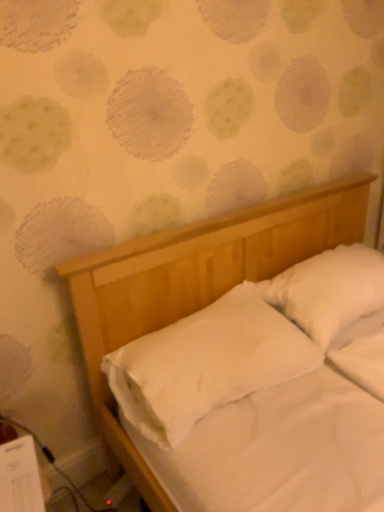
Question: Does white soft pillow at upper right, placed as the 2th pillow when sorted from left to right, turn towards white smooth pillow at center, the first pillow in the left-to-right sequence?

Choices:
 (A) yes
 (B) no

Answer: (B)

Question: Considering the relative sizes of white soft pillow at upper right, placed as the 2th pillow when sorted from left to right, and white smooth pillow at center, the first pillow in the left-to-right sequence, in the image provided, is white soft pillow at upper right, placed as the 2th pillow when sorted from left to right, wider than white smooth pillow at center, the first pillow in the left-to-right sequence,?

Choices:
 (A) yes
 (B) no

Answer: (B)

Question: Is white soft pillow at upper right, placed as the 2th pillow when sorted from left to right, placed right next to white smooth pillow at center, the first pillow in the left-to-right sequence?

Choices:
 (A) no
 (B) yes

Answer: (A)

Question: Considering the relative sizes of white soft pillow at upper right, the first pillow viewed from the right, and white smooth pillow at center, which is counted as the second pillow, starting from the right, in the image provided, is white soft pillow at upper right, the first pillow viewed from the right, shorter than white smooth pillow at center, which is counted as the second pillow, starting from the right,?

Choices:
 (A) no
 (B) yes

Answer: (A)

Question: Does white soft pillow at upper right, the first pillow viewed from the right, appear on the left side of white smooth pillow at center, the first pillow in the left-to-right sequence?

Choices:
 (A) yes
 (B) no

Answer: (B)

Question: Does white soft pillow at upper right, the first pillow viewed from the right, appear on the right side of white smooth pillow at center, which is counted as the second pillow, starting from the right?

Choices:
 (A) no
 (B) yes

Answer: (B)

Question: From the image's perspective, would you say white smooth pillow at center, the first pillow in the left-to-right sequence, is shown under white soft pillow at upper right, the first pillow viewed from the right?

Choices:
 (A) yes
 (B) no

Answer: (A)

Question: From a real-world perspective, is white smooth pillow at center, which is counted as the second pillow, starting from the right, positioned over white soft pillow at upper right, placed as the 2th pillow when sorted from left to right, based on gravity?

Choices:
 (A) yes
 (B) no

Answer: (B)

Question: From a real-world perspective, is white smooth pillow at center, which is counted as the second pillow, starting from the right, below white soft pillow at upper right, placed as the 2th pillow when sorted from left to right?

Choices:
 (A) yes
 (B) no

Answer: (A)

Question: Is white soft pillow at upper right, placed as the 2th pillow when sorted from left to right, a part of white smooth pillow at center, which is counted as the second pillow, starting from the right?

Choices:
 (A) yes
 (B) no

Answer: (B)

Question: Can you confirm if white smooth pillow at center, the first pillow in the left-to-right sequence, is shorter than white soft pillow at upper right, placed as the 2th pillow when sorted from left to right?

Choices:
 (A) yes
 (B) no

Answer: (A)

Question: Can you confirm if white smooth pillow at center, the first pillow in the left-to-right sequence, is taller than white soft pillow at upper right, placed as the 2th pillow when sorted from left to right?

Choices:
 (A) yes
 (B) no

Answer: (B)

Question: In terms of height, does white soft pillow at upper right, the first pillow viewed from the right, look taller or shorter compared to white smooth pillow at center, which is counted as the second pillow, starting from the right?

Choices:
 (A) short
 (B) tall

Answer: (B)